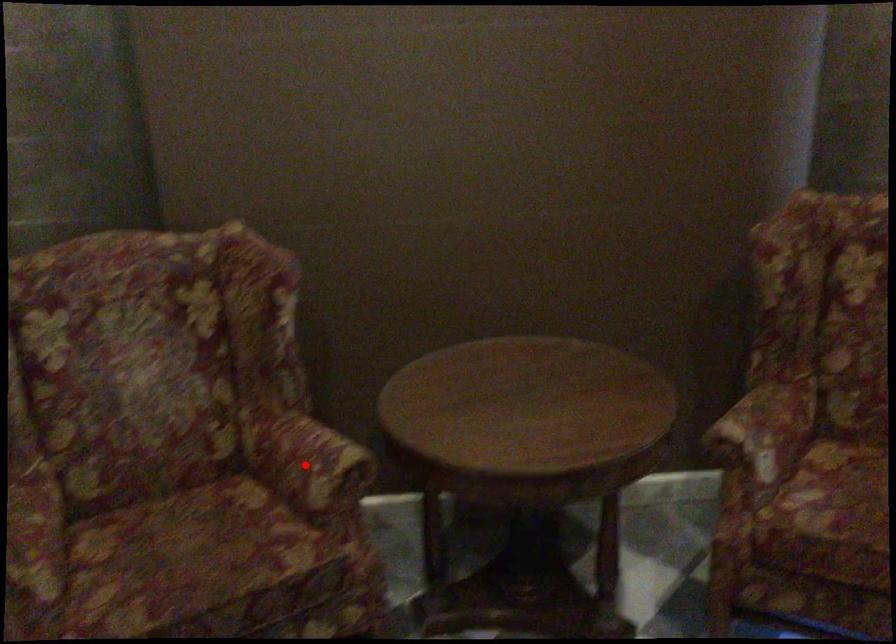
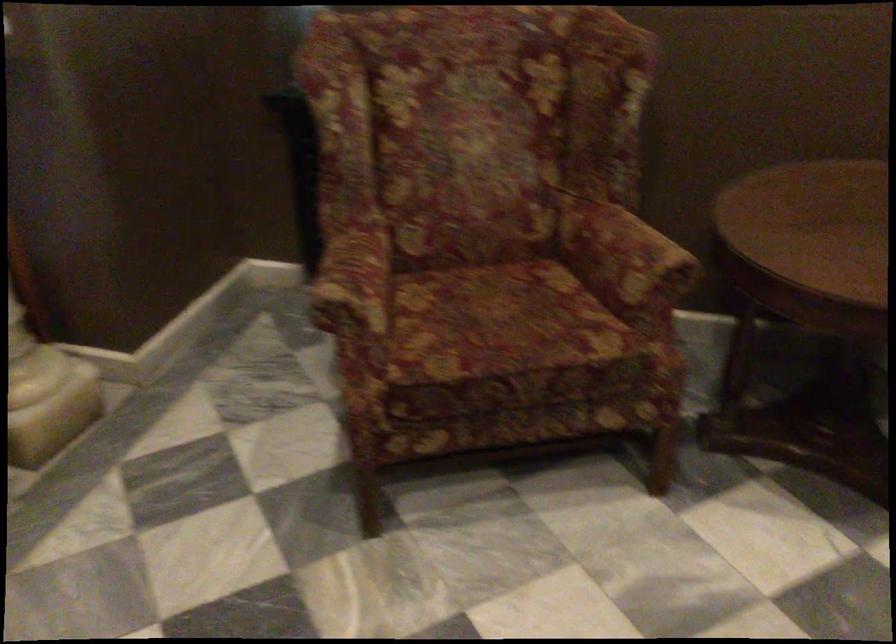
Find the pixel in the second image that matches the highlighted location in the first image.

(624, 258)